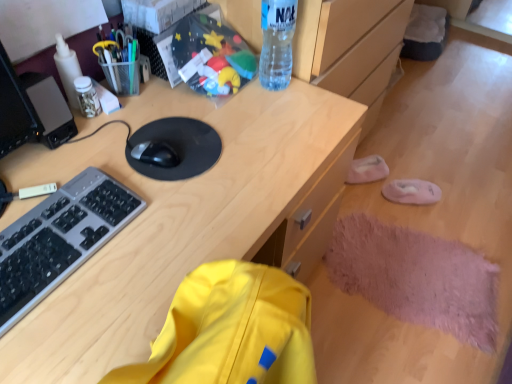
Identify the location of vacant area on top of black matte mousepad at center (from a real-world perspective). (173, 139).